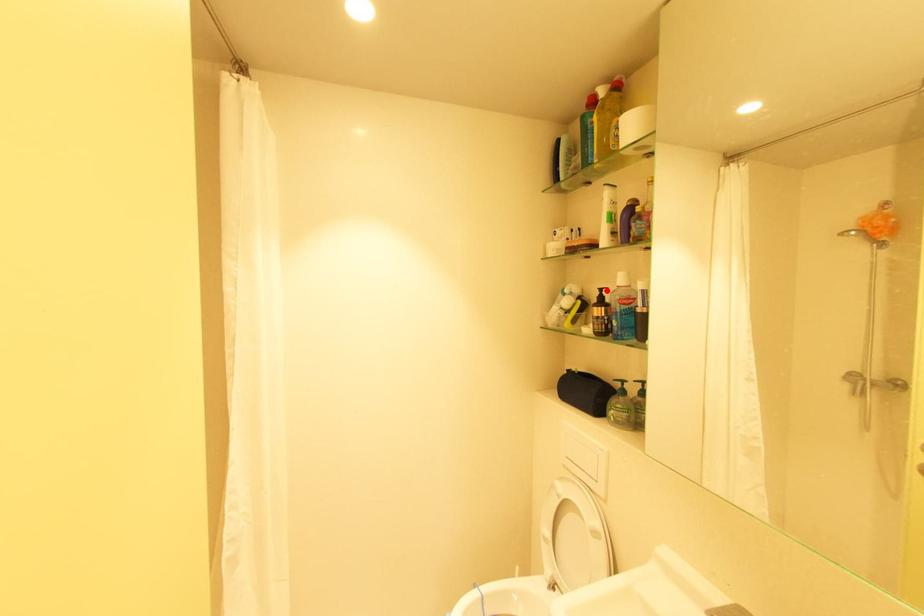
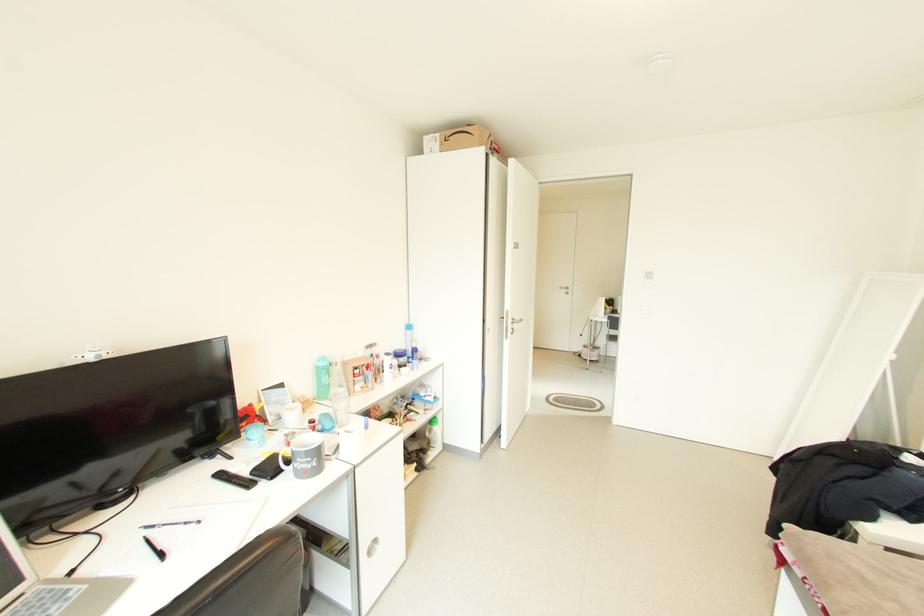
Question: I am providing you with two images of the same scene from different viewpoints. A red point is marked on the first image. At the location where the point appears in image 1, is it still visible in image 2?

Choices:
 (A) Yes
 (B) No

Answer: (B)